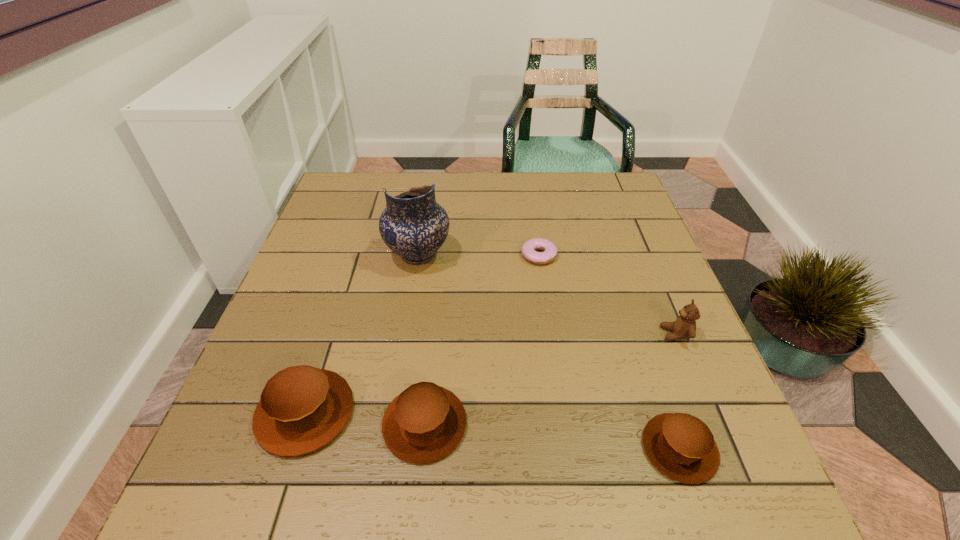
Where is `object that is positioned at the near right corner`? object that is positioned at the near right corner is located at coordinates (681, 446).

The height and width of the screenshot is (540, 960). I want to click on vacant space at the far edge, so click(x=556, y=182).

Image resolution: width=960 pixels, height=540 pixels. Identify the location of vacant area at the near edge of the desktop. (508, 417).

The image size is (960, 540). In the image, there is a desktop. Find the location of `vacant space at the left edge`. vacant space at the left edge is located at coordinates (352, 267).

Locate an element on the screen. The image size is (960, 540). free point at the right edge is located at coordinates (621, 232).

I want to click on vacant space at the far left corner, so click(x=384, y=183).

The image size is (960, 540). I want to click on free space between the leftmost muffin and the second shortest muffin, so click(x=365, y=418).

Where is `free space between the second shortest object and the second shortest muffin`? free space between the second shortest object and the second shortest muffin is located at coordinates (552, 436).

At what (x,y) coordinates should I click in order to perform the action: click on empty space between the pottery and the leftmost muffin. Please return your answer as a coordinate pair (x, y). This screenshot has height=540, width=960. Looking at the image, I should click on (362, 334).

Identify the location of free space that is in between the leftmost muffin and the fourth nearest object. This screenshot has height=540, width=960. (491, 373).